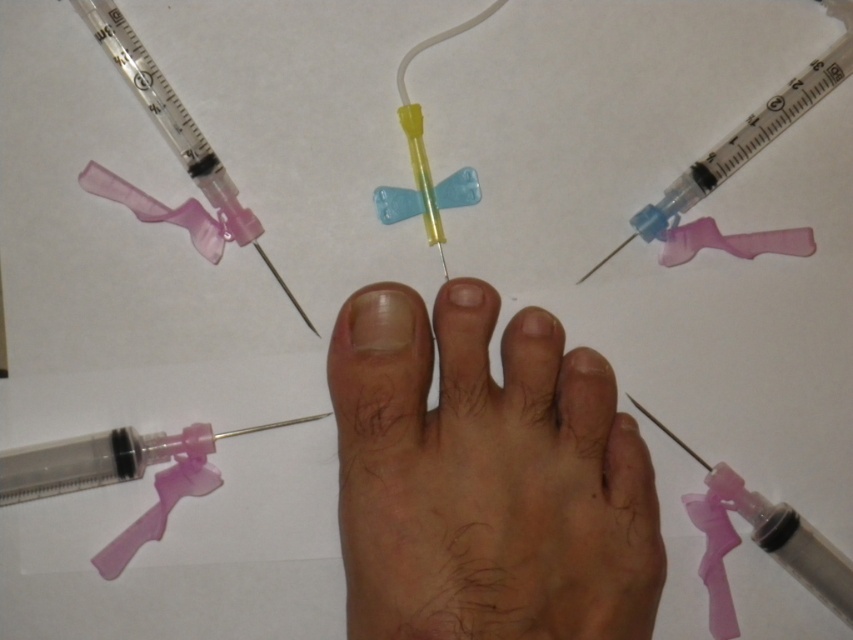
Is point (680, 179) positioned behind point (363, 323)?

Yes, it is behind point (363, 323).

Between transparent plastic syringe at upper right and pale skin nail at center, which one has less height?

With less height is pale skin nail at center.

The image size is (853, 640). What do you see at coordinates (747, 134) in the screenshot?
I see `transparent plastic syringe at upper right` at bounding box center [747, 134].

This screenshot has height=640, width=853. In order to click on transparent plastic syringe at upper right in this screenshot , I will do `click(747, 134)`.

Does pink translucent syringe at upper left have a greater width compared to pale skin nail at center?

Indeed, pink translucent syringe at upper left has a greater width compared to pale skin nail at center.

Between point (132, 72) and point (384, 289), which one is positioned behind?

The point (132, 72) is more distant.

Which is behind, point (190, 163) or point (357, 337)?

Point (190, 163)

Where is `pink translucent syringe at upper left`? pink translucent syringe at upper left is located at coordinates (175, 125).

Who is lower down, transparent plastic syringe at bottom left or transparent plastic syringe at upper right?

transparent plastic syringe at bottom left is below.

Is point (21, 484) positioned in front of point (776, 120)?

Yes, it is in front of point (776, 120).

Is point (186, 496) farther from camera compared to point (772, 125)?

No, it is in front of (772, 125).

This screenshot has height=640, width=853. Identify the location of transparent plastic syringe at bottom left. (122, 474).